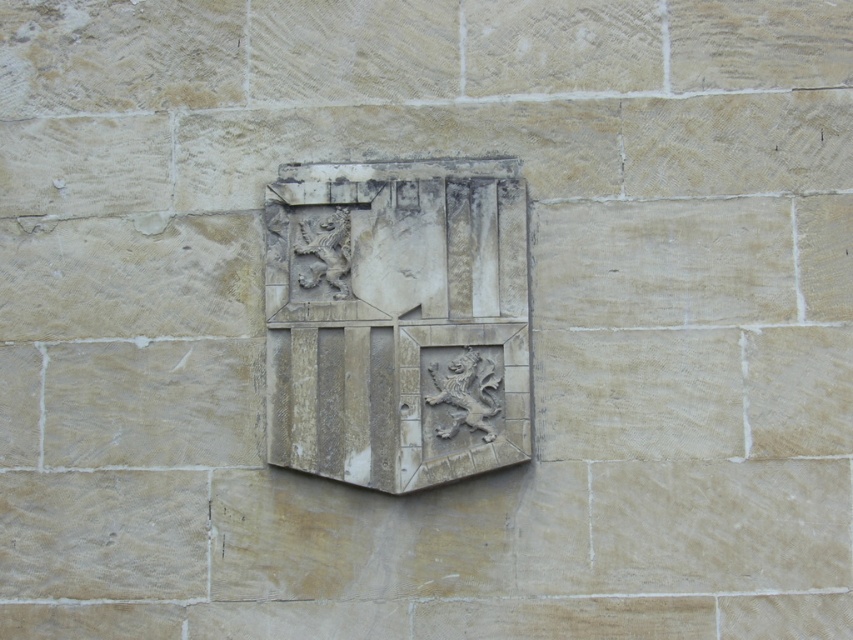
Can you confirm if stone relief emblem at center is taller than carved stone lion at center?

Correct, stone relief emblem at center is much taller as carved stone lion at center.

Between stone relief emblem at center and carved stone lion at center, which one is positioned higher?

stone relief emblem at center is above.

Identify the location of stone relief emblem at center. (397, 321).

This screenshot has height=640, width=853. In order to click on stone relief emblem at center in this screenshot , I will do (x=397, y=321).